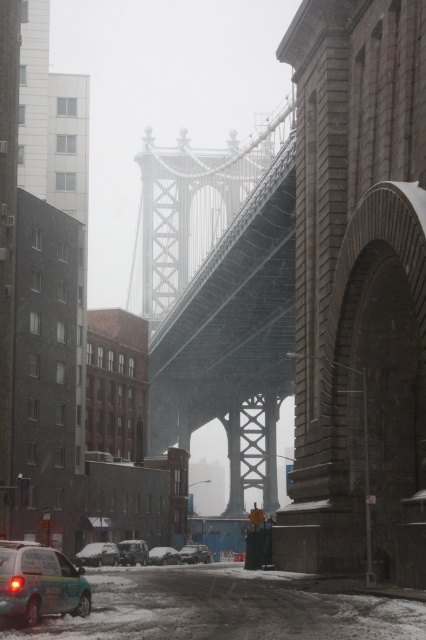
You are a drone operator planning to fly a drone over the snowy urban scene. The drone must avoid the metallic gray bridge at center. Based on the coordinates provided in the Objects Description, what are the x and y coordinates where the bridge is located?

The metallic gray bridge at center is located at point coordinates x 0.480 and y 0.528.

Looking at this image, you are a photographer standing on the sidewalk near the metallic gray bridge at center and the white matte car at center. You want to take a photo that includes both objects in the frame. Which object should you position closer to the edge of the frame to ensure both are visible?

Since the metallic gray bridge at center is closer to the viewer than the white matte car at center, you should position the metallic gray bridge at center closer to the edge of the frame to allow space for the white matte car at center, which is farther away, to still be visible in the photo.

You are a drone operator tasked with capturing aerial footage of the metallic gray bridge at center. Your drone has a maximum flight range of 70 meters. Based on the scene description, can your drone safely reach the bridge without exceeding its range limit?

The metallic gray bridge at center is 69.84 meters from camera. Since the drone has a maximum flight range of 70 meters, it can safely reach the bridge without exceeding its range limit as the distance is just under the maximum limit.